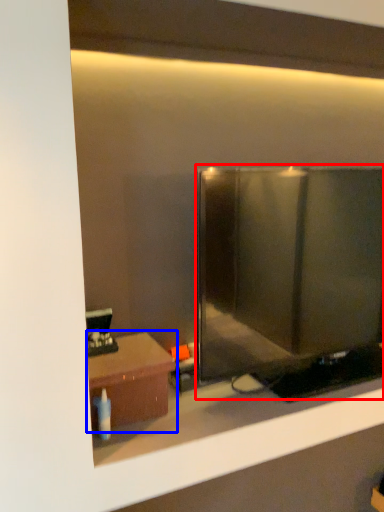
Question: Among these objects, which one is farthest to the camera, glass door (highlighted by a red box) or table (highlighted by a blue box)?

Choices:
 (A) glass door
 (B) table

Answer: (B)